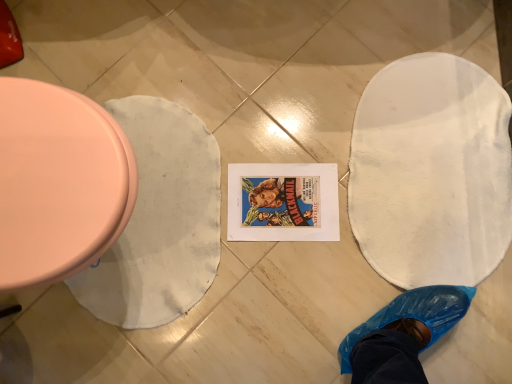
Find the location of a particular element. matte pink toilet at left is located at coordinates (x=59, y=182).

Based on the photo, what is the approximate height of matte pink toilet at left?

matte pink toilet at left is 45.79 centimeters tall.

Measure the distance between point (81, 199) and camera.

Point (81, 199) and camera are 67.70 centimeters apart from each other.

This screenshot has width=512, height=384. What do you see at coordinates (59, 182) in the screenshot? I see `matte pink toilet at left` at bounding box center [59, 182].

What do you see at coordinates (160, 220) in the screenshot? The width and height of the screenshot is (512, 384). I see `white fabric blanket at left` at bounding box center [160, 220].

Measure the distance between white fabric blanket at left and camera.

A distance of 3.54 feet exists between white fabric blanket at left and camera.

You are a GUI agent. You are given a task and a screenshot of the screen. Output one action in this format:
    pyautogui.click(x=<x>, y=<y>)
    Task: Click on the white fabric blanket at left
    This screenshot has width=512, height=384.
    Given the screenshot: What is the action you would take?
    pyautogui.click(x=160, y=220)

You are a GUI agent. You are given a task and a screenshot of the screen. Output one action in this format:
    pyautogui.click(x=<x>, y=<y>)
    Task: Click on the matte pink toilet at left
    
    Given the screenshot: What is the action you would take?
    59,182

Considering the positions of objects matte pink toilet at left and white fabric blanket at left in the image provided, who is more to the right, matte pink toilet at left or white fabric blanket at left?

Positioned to the right is white fabric blanket at left.

In the image, is matte pink toilet at left positioned in front of or behind white fabric blanket at left?

Visually, matte pink toilet at left is located in front of white fabric blanket at left.

Is point (63, 173) closer or farther from the camera than point (182, 108)?

Clearly, point (63, 173) is closer to the camera than point (182, 108).

From the image's perspective, which is below, matte pink toilet at left or white fabric blanket at left?

From the image's view, white fabric blanket at left is below.

From a real-world perspective, who is located higher, matte pink toilet at left or white fabric blanket at left?

matte pink toilet at left is physically above.

Considering the sizes of objects matte pink toilet at left and white fabric blanket at left in the image provided, who is thinner, matte pink toilet at left or white fabric blanket at left?

Thinner between the two is white fabric blanket at left.

From their relative heights in the image, would you say matte pink toilet at left is taller or shorter than white fabric blanket at left?

matte pink toilet at left is taller than white fabric blanket at left.

Considering the relative sizes of matte pink toilet at left and white fabric blanket at left in the image provided, is matte pink toilet at left smaller than white fabric blanket at left?

Actually, matte pink toilet at left might be larger than white fabric blanket at left.

Looking at this image, is matte pink toilet at left situated inside white fabric blanket at left or outside?

matte pink toilet at left is not inside white fabric blanket at left, it's outside.

Are matte pink toilet at left and white fabric blanket at left far apart?

matte pink toilet at left is actually quite close to white fabric blanket at left.

Is matte pink toilet at left oriented away from white fabric blanket at left?

That's not correct — matte pink toilet at left is not looking away from white fabric blanket at left.

At what (x,y) coordinates should I click in order to perform the action: click on toilet that appears on the left of white fabric blanket at left. Please return your answer as a coordinate pair (x, y). This screenshot has width=512, height=384. Looking at the image, I should click on (59, 182).

Can you confirm if white fabric blanket at left is positioned to the right of matte pink toilet at left?

Correct, you'll find white fabric blanket at left to the right of matte pink toilet at left.

Relative to matte pink toilet at left, is white fabric blanket at left in front or behind?

Clearly, white fabric blanket at left is behind matte pink toilet at left.

Considering the points (183, 129) and (109, 202), which point is behind, point (183, 129) or point (109, 202)?

The point (183, 129) is more distant.

From the image's perspective, between white fabric blanket at left and matte pink toilet at left, who is located below?

white fabric blanket at left is shown below in the image.

From a real-world perspective, who is located lower, white fabric blanket at left or matte pink toilet at left?

white fabric blanket at left.

Looking at their sizes, would you say white fabric blanket at left is wider or thinner than matte pink toilet at left?

Considering their sizes, white fabric blanket at left looks slimmer than matte pink toilet at left.

Can you confirm if white fabric blanket at left is shorter than matte pink toilet at left?

Correct, white fabric blanket at left is not as tall as matte pink toilet at left.

Between white fabric blanket at left and matte pink toilet at left, which one has larger size?

matte pink toilet at left.

Is matte pink toilet at left inside white fabric blanket at left?

No, matte pink toilet at left is not a part of white fabric blanket at left.

Would you say white fabric blanket at left is a long distance from matte pink toilet at left?

No.

Is white fabric blanket at left facing towards matte pink toilet at left?

No.

How different are the orientations of white fabric blanket at left and matte pink toilet at left in degrees?

The facing directions of white fabric blanket at left and matte pink toilet at left are 0.254 degrees apart.

Measure the distance between white fabric blanket at left and matte pink toilet at left.

white fabric blanket at left and matte pink toilet at left are 16.93 inches apart.

Locate an element on the screen. toilet above the white fabric blanket at left (from a real-world perspective) is located at coordinates (59, 182).

Identify the location of blanket below the matte pink toilet at left (from a real-world perspective). (160, 220).

Where is `toilet on the left of the white fabric blanket at left`? The width and height of the screenshot is (512, 384). toilet on the left of the white fabric blanket at left is located at coordinates (59, 182).